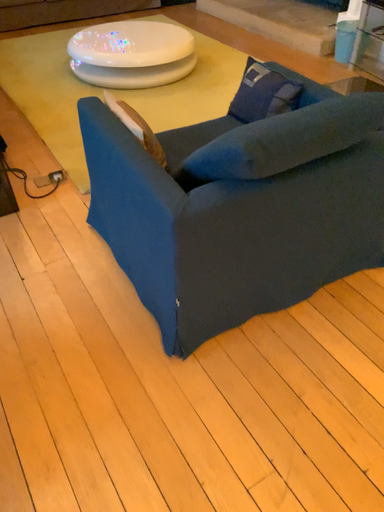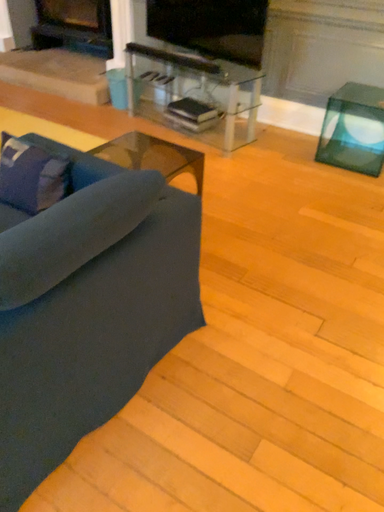
Question: Which way did the camera rotate in the video?

Choices:
 (A) rotated upward
 (B) rotated downward

Answer: (A)